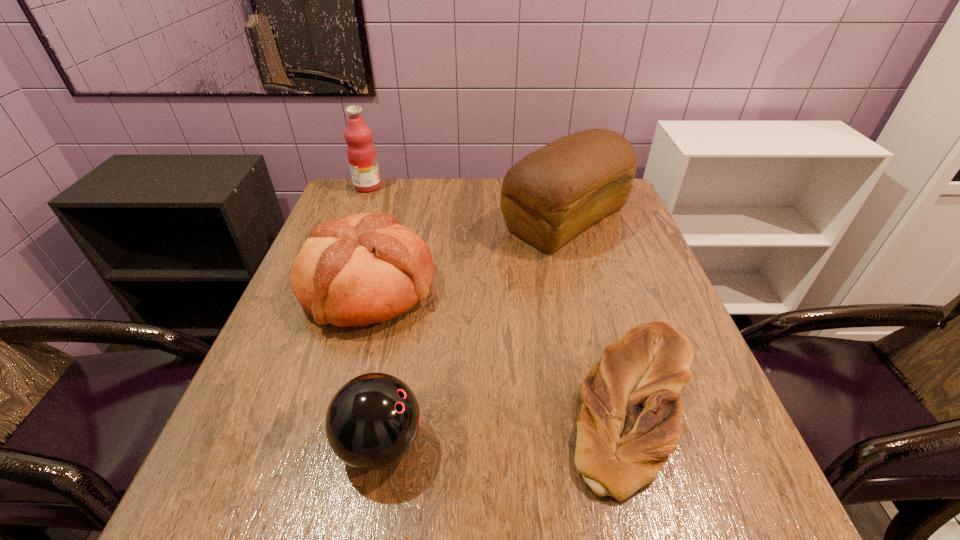
In the image, there is a desktop. Find the location of `vacant space at the near edge`. vacant space at the near edge is located at coordinates pyautogui.click(x=463, y=503).

The height and width of the screenshot is (540, 960). Identify the location of free space at the left edge of the desktop. (297, 343).

At what (x,y) coordinates should I click in order to perform the action: click on vacant space at the right edge. Please return your answer as a coordinate pair (x, y). This screenshot has height=540, width=960. Looking at the image, I should click on (743, 458).

This screenshot has height=540, width=960. In order to click on vacant space at the far left corner of the desktop in this screenshot , I will do `click(385, 180)`.

This screenshot has height=540, width=960. I want to click on vacant space at the near left corner, so click(x=261, y=496).

I want to click on unoccupied position between the bowling ball and the shortest bread, so click(508, 424).

Where is `free point between the shortest object and the second tallest bread`? free point between the shortest object and the second tallest bread is located at coordinates (501, 346).

I want to click on empty space between the second shortest bread and the bowling ball, so click(374, 366).

The width and height of the screenshot is (960, 540). In order to click on unoccupied position between the leftmost bread and the tallest bread in this screenshot , I will do `click(467, 253)`.

Image resolution: width=960 pixels, height=540 pixels. In order to click on free space between the fruit juice and the tallest bread in this screenshot , I will do `click(467, 202)`.